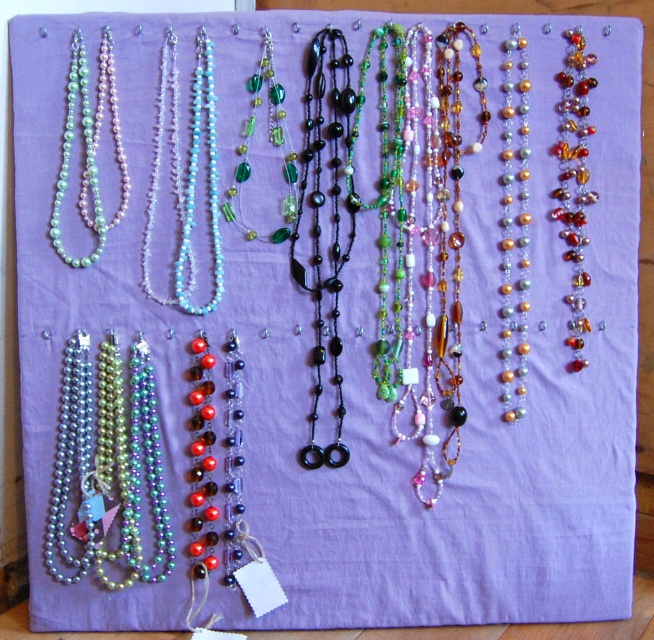
You are organizing necklaces on a display. You have two necklaces to place next to each other. One has translucent blue beads at upper left and the other has green glass beads at upper center. Which necklace should you choose if you want the beads to be wider?

The translucent blue beads at upper left might be wider than the green glass beads at upper center, so you should choose the necklace with translucent blue beads at upper left.

You are holding a small ruler that is 3 feet long. You want to measure the distance from your eyes to the black glass beads at center. Can your ruler reach that distance?

The black glass beads at center are 3.35 feet away from the viewer. Since your ruler is only 3 feet long, it cannot reach the full distance required.